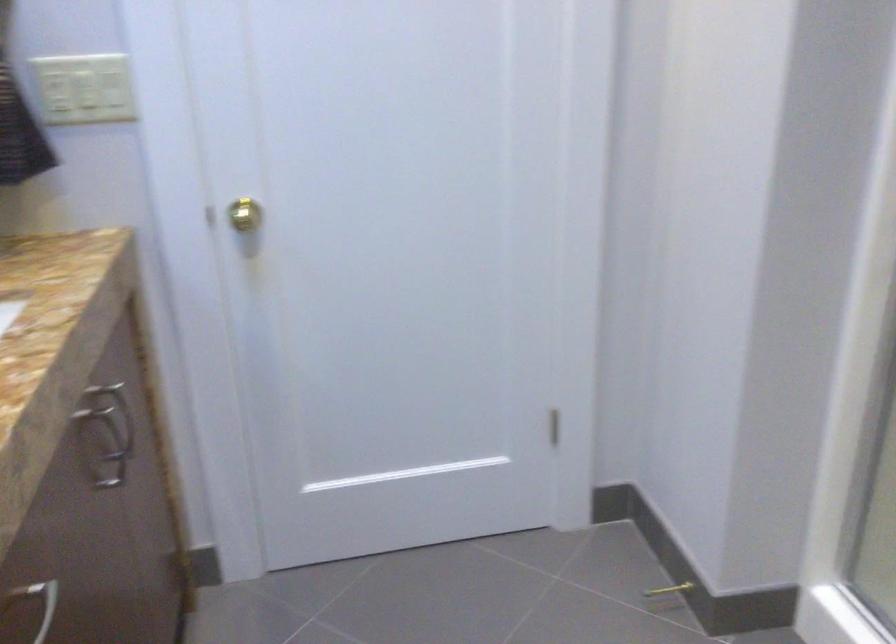
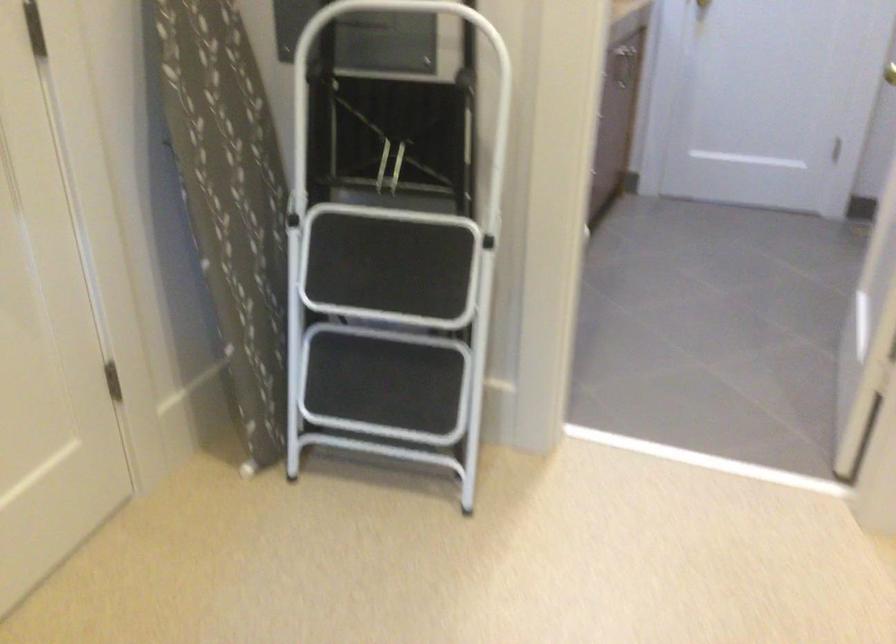
Question: I am providing you with two images of the same scene from different viewpoints. After the viewpoint changes to image2, which objects are now occluded?

Choices:
 (A) metal cabinet handle
 (B) black stool step
 (C) patterned ironing board
 (D) green fabric basket

Answer: (A)